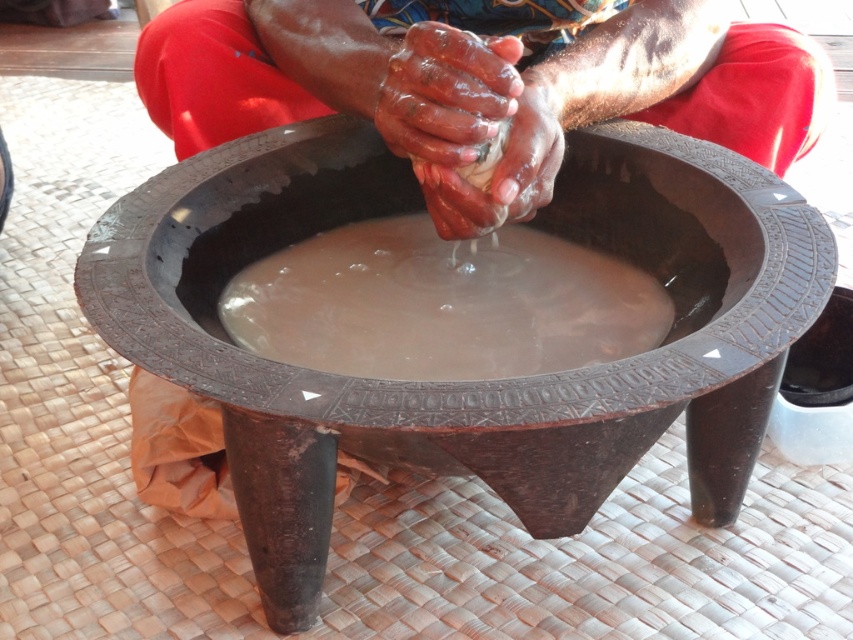
You are observing a traditional handwashing ritual. The scene includes a person washing their hands in a large wooden bowl filled with water. You notice two items at the center of the bowl labeled as smooth clay hands at center and smooth clay mud at center. Based on their positions, which item is located to the right?

The smooth clay hands at center is to the right of the smooth clay mud at center according to the description.

You are standing in front of the carved wooden bowl at center. If you move 0.1 units to the right and 0.05 units down from your current position, will you be closer to or farther from the bowl?

Moving 0.1 units to the right and 0.05 units down from your current position will bring you closer to the carved wooden bowl at center located at point (473, 381). The new position would be at approximately (515, 445), which is closer in distance compared to the original position.

You are standing in the scene and want to place a small decoration between the two points, point (775,348) and point (294,76). Which point should the decoration be closer to in order to be centered between them?

To place the decoration centered between point (775,348) and point (294,76), it should be equidistant from both points. However, since point (775,348) is in front of point (294,76), the decoration would naturally be closer to point (775,348) in terms of depth to maintain visual balance.